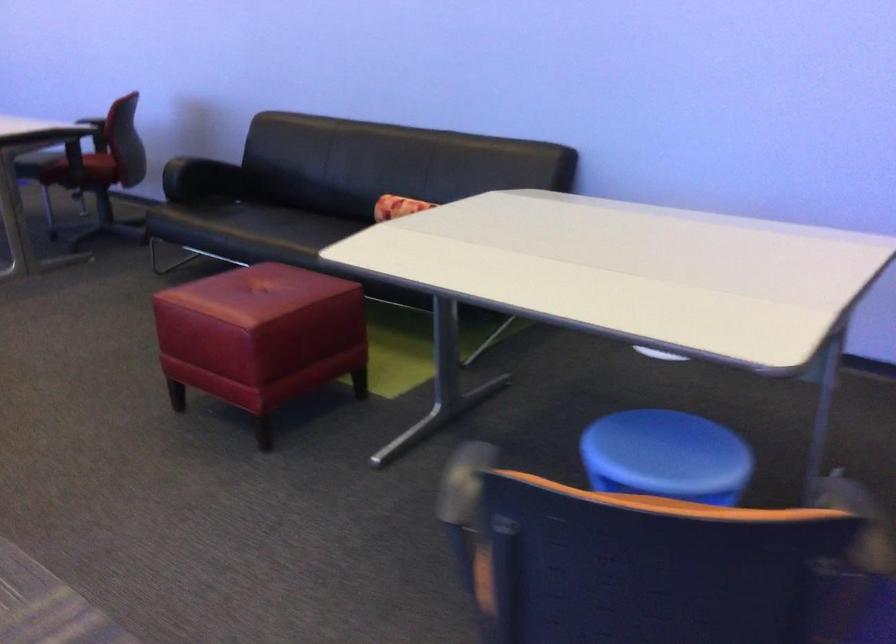
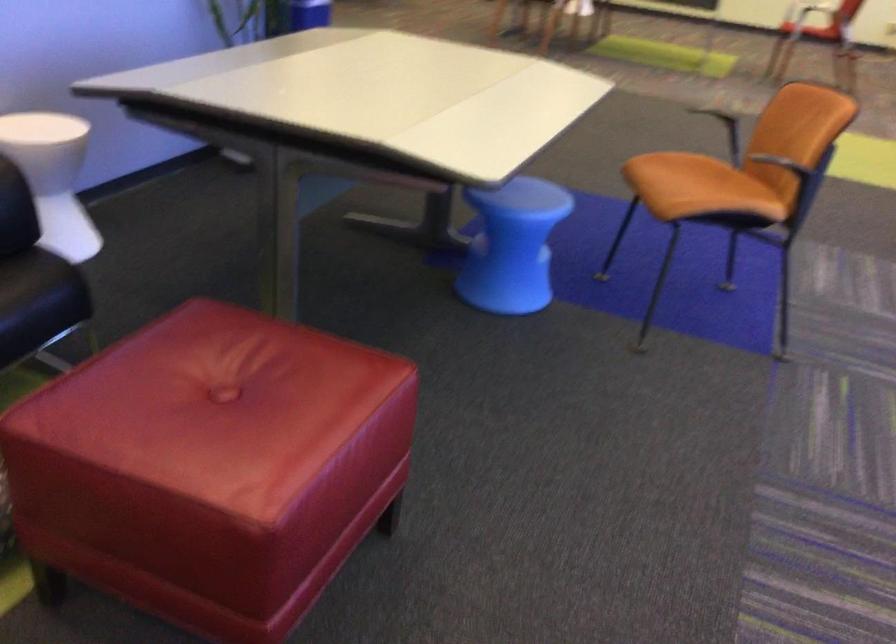
Where in the second image is the point corresponding to pixel 605 483 from the first image?

(512, 245)